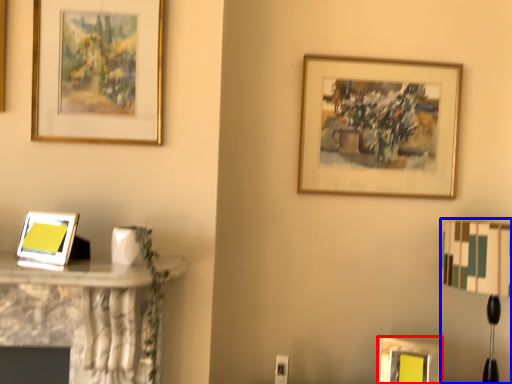
Question: Among these objects, which one is farthest to the camera, picture frame (highlighted by a red box) or table lamp (highlighted by a blue box)?

Choices:
 (A) picture frame
 (B) table lamp

Answer: (A)